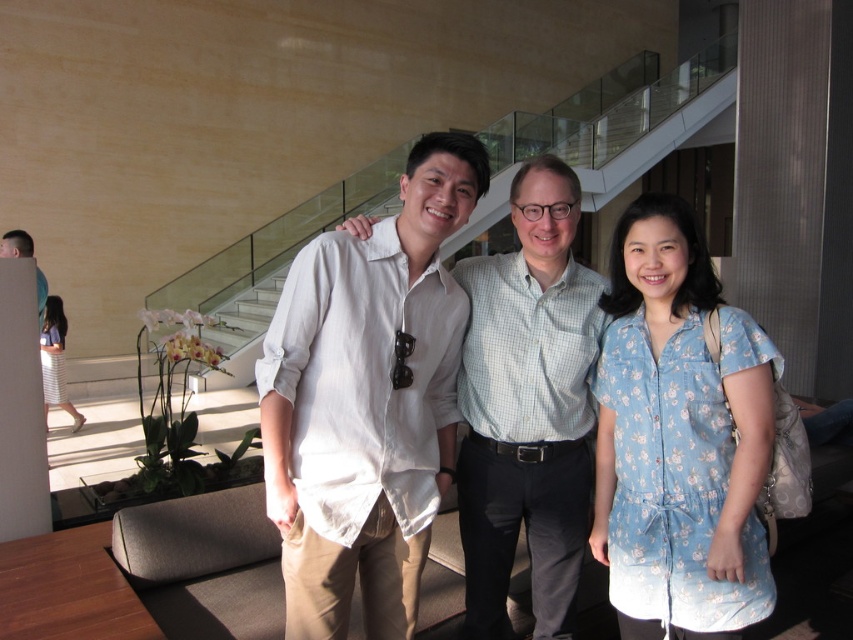
Question: Which of the following is the farthest from the observer?

Choices:
 (A) (6, 250)
 (B) (662, 312)

Answer: (A)

Question: Which point is farther to the camera?

Choices:
 (A) (625, 442)
 (B) (73, 417)

Answer: (B)

Question: Which of these objects is positioned closest to the white cotton shirt at center?

Choices:
 (A) blue floral dress at center
 (B) matte black shirt at left
 (C) light blue checkered shirt at center
 (D) white linen shirt at center

Answer: (D)

Question: Is light blue checkered shirt at center smaller than light blue floral dress at lower left?

Choices:
 (A) yes
 (B) no

Answer: (A)

Question: Does white linen shirt at center appear on the right side of matte black shirt at left?

Choices:
 (A) no
 (B) yes

Answer: (B)

Question: Does blue floral dress at center appear over light blue floral dress at lower left?

Choices:
 (A) no
 (B) yes

Answer: (B)